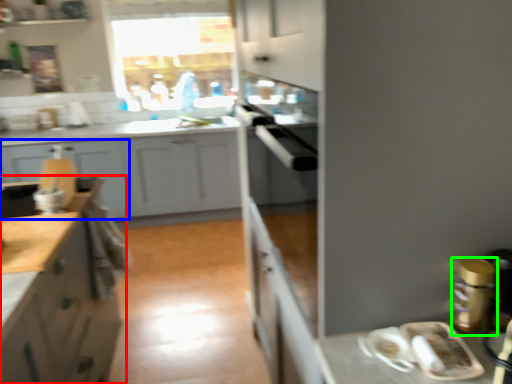
Question: Which object is the closest to the cabinetry (highlighted by a red box)? Choose among these: cabinetry (highlighted by a blue box) or appliance (highlighted by a green box).

Choices:
 (A) cabinetry
 (B) appliance

Answer: (B)